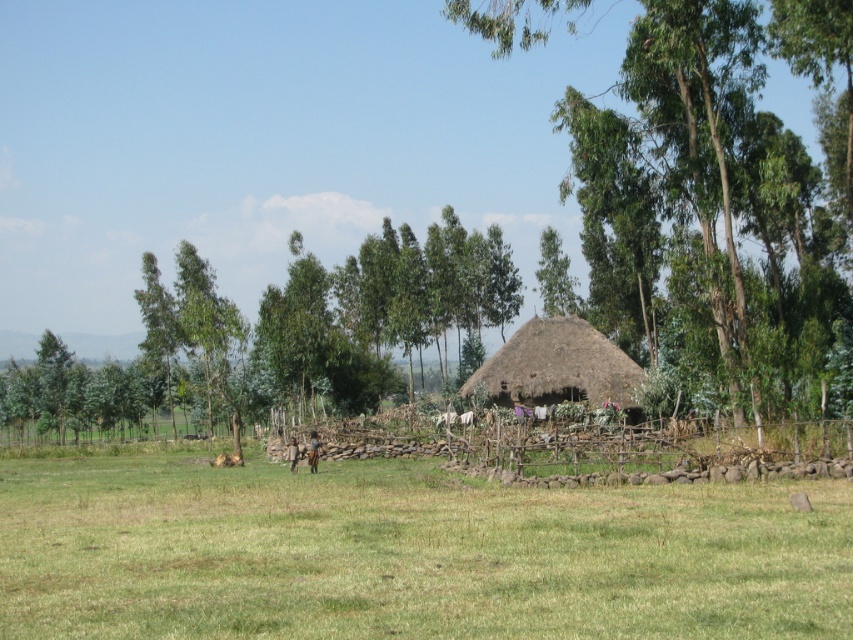
Question: Considering the real-world distances, which object is farthest from the green leafy tree at center?

Choices:
 (A) brown thatch hut at center
 (B) green grassy field at center

Answer: (B)

Question: Is green grassy field at center below green leafy tree at center?

Choices:
 (A) yes
 (B) no

Answer: (A)

Question: Among these objects, which one is nearest to the camera?

Choices:
 (A) brown thatch hut at center
 (B) green grassy field at center
 (C) green leafy tree at center

Answer: (B)

Question: Can you confirm if green grassy field at center is bigger than green leafy tree at center?

Choices:
 (A) yes
 (B) no

Answer: (B)

Question: In this image, where is green grassy field at center located relative to brown thatch hut at center?

Choices:
 (A) right
 (B) left

Answer: (B)

Question: Which of the following is the farthest from the observer?

Choices:
 (A) (619, 148)
 (B) (67, 500)

Answer: (A)